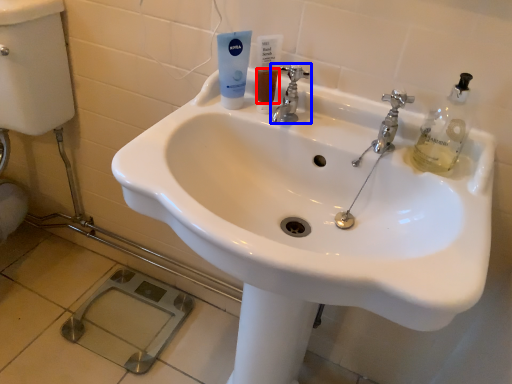
Question: Which of the following is the closest to the observer, liquid (highlighted by a red box) or tap (highlighted by a blue box)?

Choices:
 (A) liquid
 (B) tap

Answer: (B)